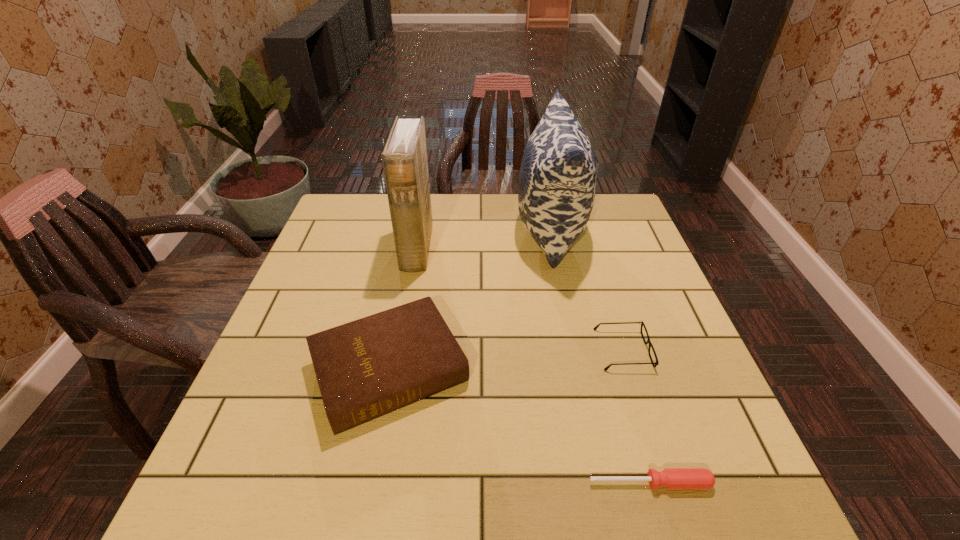
Identify the location of blank area in the image that satisfies the following two spatial constraints: 1. on the front surface of the nearest object; 2. on the left side of the cushion. The height and width of the screenshot is (540, 960). (602, 483).

The width and height of the screenshot is (960, 540). Find the location of `vacant space that satisfies the following two spatial constraints: 1. on the front side of the nearest object; 2. on the left side of the Bible`. vacant space that satisfies the following two spatial constraints: 1. on the front side of the nearest object; 2. on the left side of the Bible is located at coordinates (369, 483).

Find the location of a particular element. vacant space that satisfies the following two spatial constraints: 1. on the front-facing side of the spectacles; 2. on the front side of the screwdriver is located at coordinates (665, 483).

Image resolution: width=960 pixels, height=540 pixels. Identify the location of free spot that satisfies the following two spatial constraints: 1. on the front surface of the screwdriver; 2. on the left side of the cushion. (602, 483).